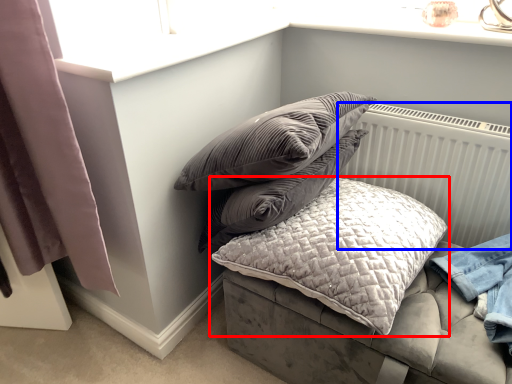
Question: Which object is further to the camera taking this photo, pillow (highlighted by a red box) or radiator (highlighted by a blue box)?

Choices:
 (A) pillow
 (B) radiator

Answer: (B)